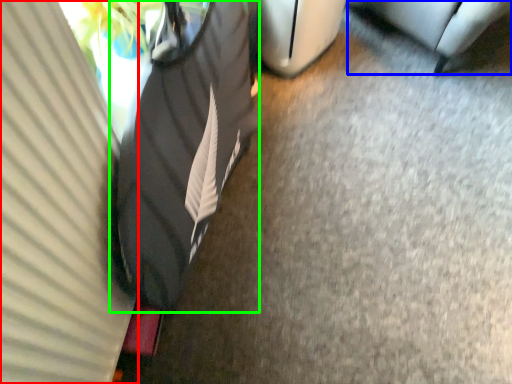
Question: Which object is the farthest from curtain (highlighted by a red box)? Choose among these: furniture (highlighted by a blue box) or bean bag chair (highlighted by a green box).

Choices:
 (A) furniture
 (B) bean bag chair

Answer: (A)